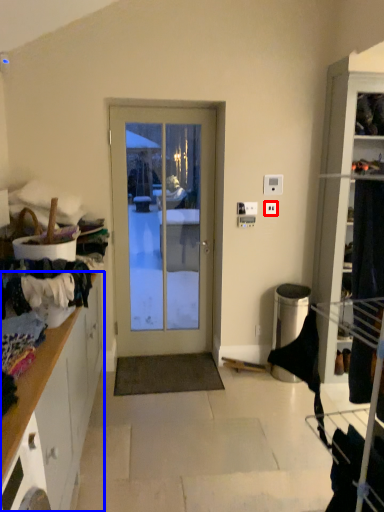
Question: Which point is closer to the camera, electric outlet (highlighted by a red box) or cabinetry (highlighted by a blue box)?

Choices:
 (A) electric outlet
 (B) cabinetry

Answer: (B)